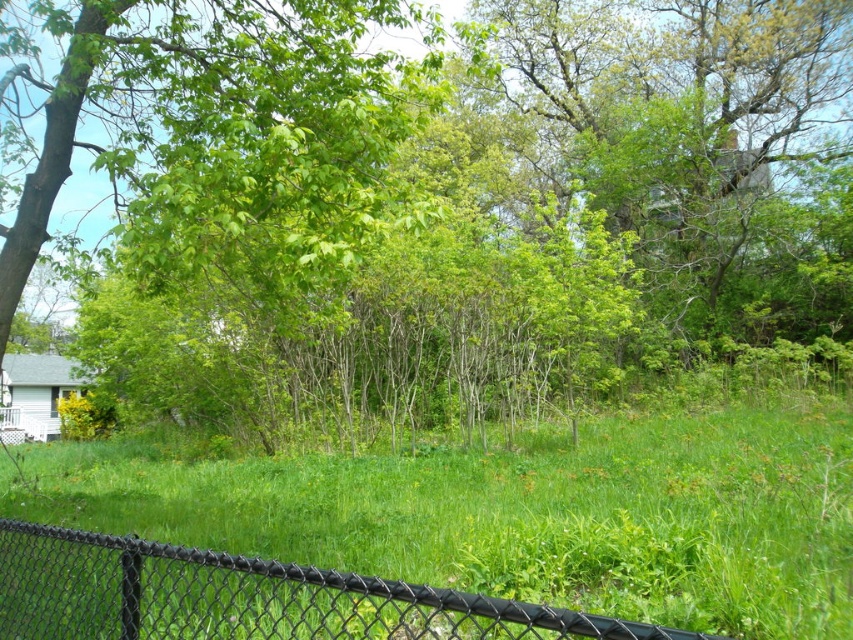
Question: Which object is closer to the camera taking this photo?

Choices:
 (A) black chain-link fence at lower center
 (B) green grassy at center

Answer: (A)

Question: Can you confirm if green grassy at center is positioned below black chain-link fence at lower center?

Choices:
 (A) no
 (B) yes

Answer: (B)

Question: Can you confirm if green leafy tree at center is wider than black chain-link fence at lower center?

Choices:
 (A) no
 (B) yes

Answer: (B)

Question: Estimate the real-world distances between objects in this image. Which object is farther from the green grassy at center?

Choices:
 (A) black chain-link fence at lower center
 (B) green leafy tree at center

Answer: (B)

Question: Does green leafy tree at center appear on the right side of green grassy at center?

Choices:
 (A) yes
 (B) no

Answer: (B)

Question: Among these objects, which one is nearest to the camera?

Choices:
 (A) black chain-link fence at lower center
 (B) green leafy tree at center

Answer: (A)